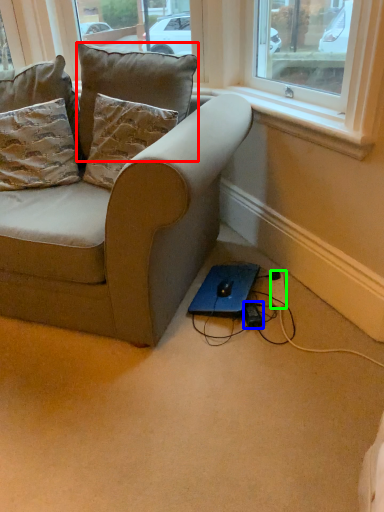
Question: Based on their relative distances, which object is nearer to pillow (highlighted by a red box)? Choose from plug (highlighted by a blue box) and extension cord (highlighted by a green box).

Choices:
 (A) plug
 (B) extension cord

Answer: (B)